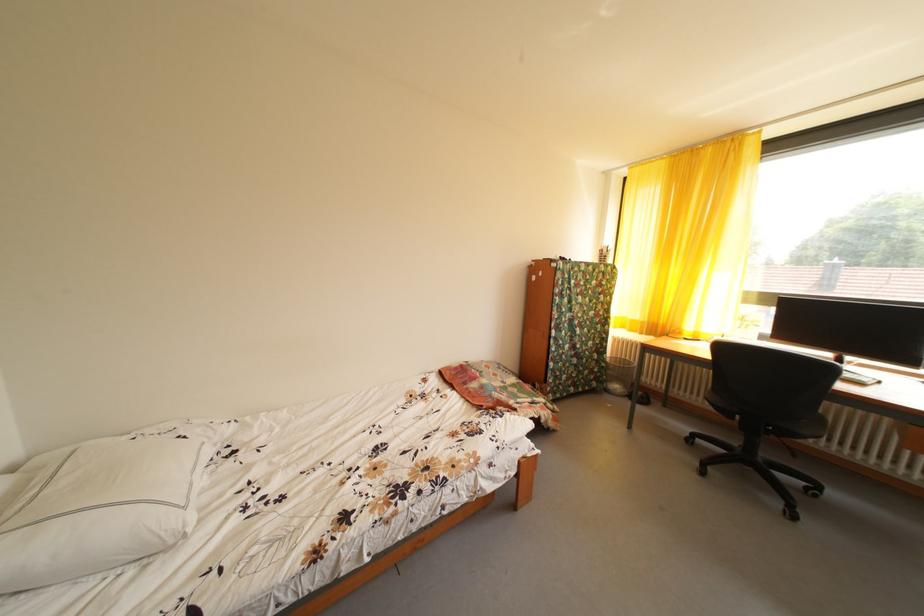
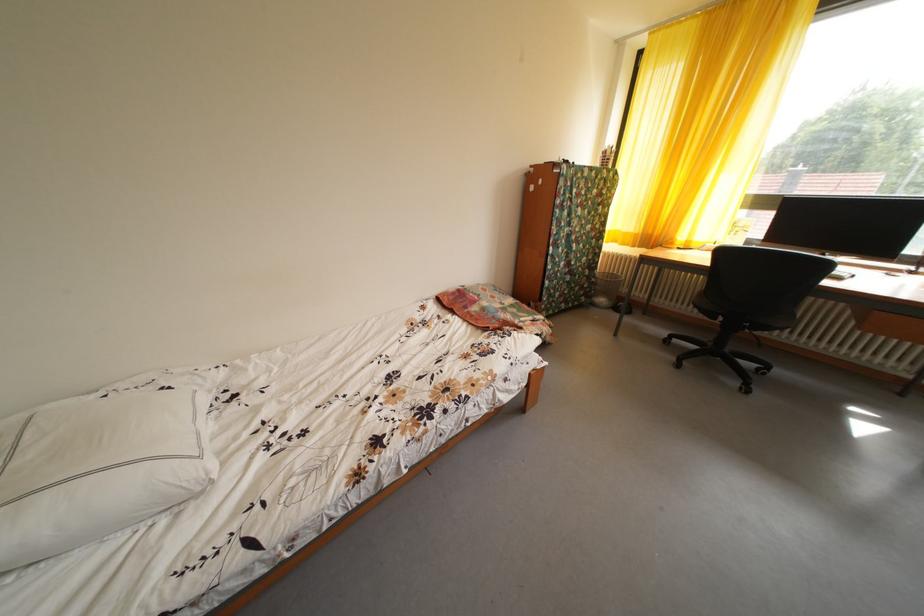
The images are taken continuously from a first-person perspective. In which direction are you moving?

The cameraman moved toward left, forward.